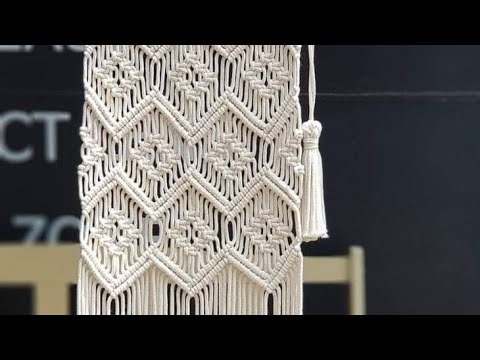
Where is `chair`? The image size is (480, 360). chair is located at coordinates (332, 273), (75, 270).